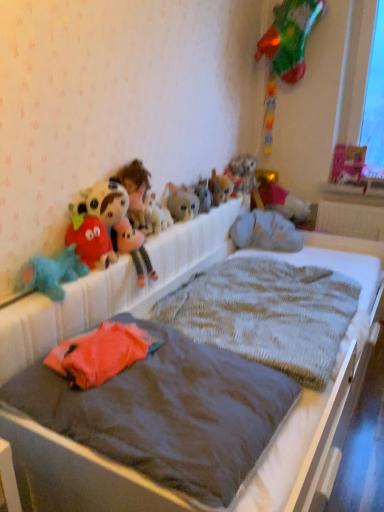
Question: Which direction should I rotate to face fuzzy plush toys at center, which appears as the sixth toy when viewed from the left, — up or down?

Choices:
 (A) up
 (B) down

Answer: (A)

Question: Can you confirm if gray fabric teddy bear at upper center, which is the 10th toy from left to right, is taller than fluffy plush toy at upper center, which ranks as the 3th toy in left-to-right order?

Choices:
 (A) yes
 (B) no

Answer: (B)

Question: Is gray fabric teddy bear at upper center, which appears as the second toy when viewed from the right, bigger than fluffy plush toy at upper center, the 9th toy when ordered from right to left?

Choices:
 (A) yes
 (B) no

Answer: (A)

Question: Can you confirm if gray fabric teddy bear at upper center, which appears as the second toy when viewed from the right, is thinner than fluffy plush toy at upper center, the 9th toy when ordered from right to left?

Choices:
 (A) yes
 (B) no

Answer: (B)

Question: From a real-world perspective, is gray fabric teddy bear at upper center, which is the 10th toy from left to right, located beneath fluffy plush toy at upper center, which ranks as the 3th toy in left-to-right order?

Choices:
 (A) no
 (B) yes

Answer: (B)

Question: Is gray fabric teddy bear at upper center, which appears as the second toy when viewed from the right, to the left of fluffy plush toy at upper center, which ranks as the 3th toy in left-to-right order, from the viewer's perspective?

Choices:
 (A) yes
 (B) no

Answer: (B)

Question: Is gray fabric teddy bear at upper center, which appears as the second toy when viewed from the right, closer to camera compared to fluffy plush toy at upper center, the 9th toy when ordered from right to left?

Choices:
 (A) yes
 (B) no

Answer: (B)

Question: Is fluffy plush toy at center, the 8th toy viewed from the right, positioned with its back to fluffy gray stuffed animal at center, which appears as the 5th toy when viewed from the right?

Choices:
 (A) yes
 (B) no

Answer: (B)

Question: Does fluffy plush toy at center, the 8th toy viewed from the right, have a greater width compared to fluffy gray stuffed animal at center, which appears as the 5th toy when viewed from the right?

Choices:
 (A) no
 (B) yes

Answer: (A)

Question: Can you confirm if fluffy plush toy at center, the 8th toy viewed from the right, is taller than fluffy gray stuffed animal at center, which appears as the 5th toy when viewed from the right?

Choices:
 (A) yes
 (B) no

Answer: (B)

Question: From the image's perspective, is fluffy plush toy at center, the 8th toy viewed from the right, beneath fluffy gray stuffed animal at center, which ranks as the 7th toy in left-to-right order?

Choices:
 (A) no
 (B) yes

Answer: (B)

Question: From a real-world perspective, is fluffy plush toy at center, acting as the 4th toy starting from the left, below fluffy gray stuffed animal at center, which ranks as the 7th toy in left-to-right order?

Choices:
 (A) no
 (B) yes

Answer: (B)

Question: Considering the relative positions of fluffy plush toy at center, the 8th toy viewed from the right, and fluffy gray stuffed animal at center, which appears as the 5th toy when viewed from the right, in the image provided, is fluffy plush toy at center, the 8th toy viewed from the right, in front of fluffy gray stuffed animal at center, which appears as the 5th toy when viewed from the right,?

Choices:
 (A) yes
 (B) no

Answer: (A)

Question: From a real-world perspective, is knitted gray blanket at center, which is the second mattress from front to back, located higher than fluffy plush toy at center, acting as the 4th toy starting from the left?

Choices:
 (A) no
 (B) yes

Answer: (A)